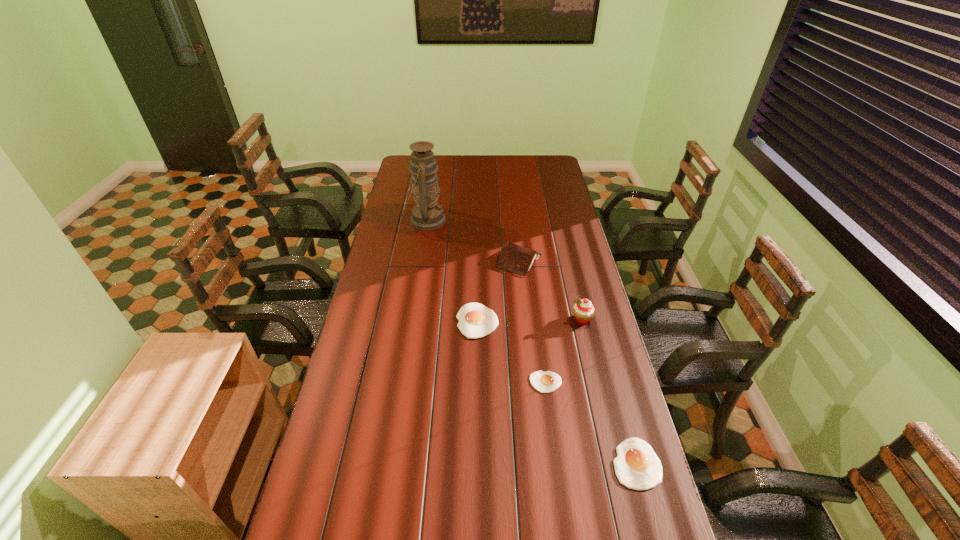
I want to click on free space between the farthest object and the fifth tallest object, so click(x=531, y=342).

Locate an element on the screen. This screenshot has height=540, width=960. free point between the shortest egg yolk and the third tallest object is located at coordinates [533, 321].

Where is `unoccupied area between the farthest egg yolk and the second farthest egg yolk`? unoccupied area between the farthest egg yolk and the second farthest egg yolk is located at coordinates (512, 352).

Locate an element on the screen. Image resolution: width=960 pixels, height=540 pixels. free space between the shortest object and the fifth tallest object is located at coordinates (591, 423).

Where is `object that can be found as the second closest to the fifth shortest object`? This screenshot has height=540, width=960. object that can be found as the second closest to the fifth shortest object is located at coordinates click(x=545, y=382).

The height and width of the screenshot is (540, 960). Find the location of `object that is the nearest to the farthest egg yolk`. object that is the nearest to the farthest egg yolk is located at coordinates (514, 258).

Identify the location of the second closest egg yolk relative to the leftmost object. (545, 382).

Select which egg yolk is the second closest to the third tallest object. Please provide its 2D coordinates. Your answer should be formatted as a tuple, i.e. [(x, y)], where the tuple contains the x and y coordinates of a point satisfying the conditions above.

[(545, 382)]

At what (x,y) coordinates should I click in order to perform the action: click on free location that satisfies the following two spatial constraints: 1. on the front side of the fifth farthest object; 2. on the right side of the farthest egg yolk. Please return your answer as a coordinate pair (x, y). Image resolution: width=960 pixels, height=540 pixels. Looking at the image, I should click on (477, 382).

Locate an element on the screen. The height and width of the screenshot is (540, 960). vacant space that satisfies the following two spatial constraints: 1. on the front side of the fifth shortest object; 2. on the right side of the third tallest object is located at coordinates (525, 319).